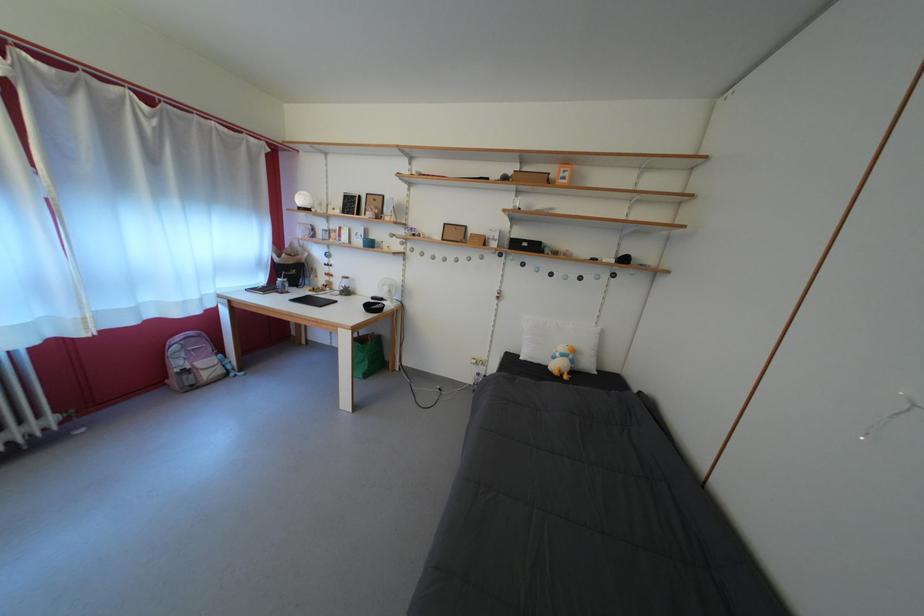
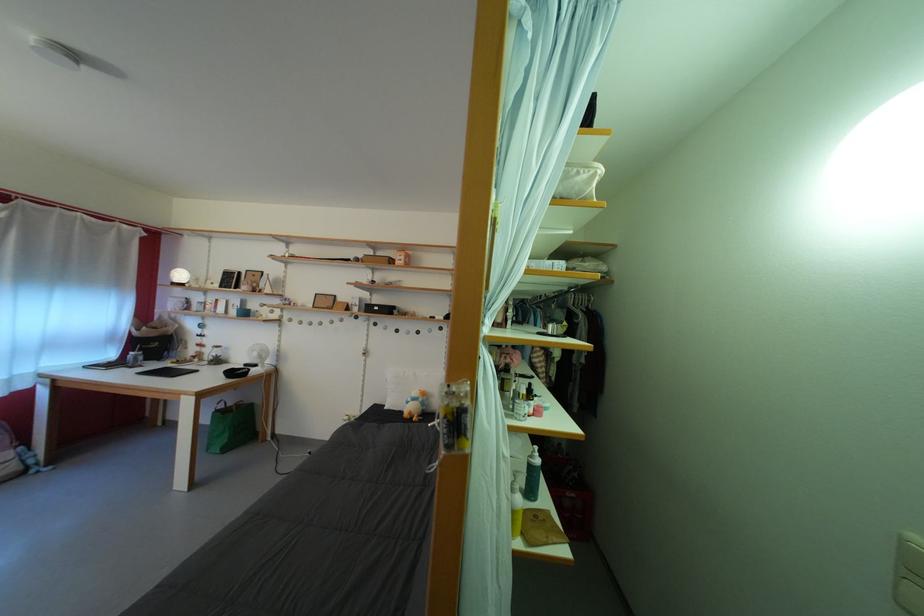
The point at (533, 251) is marked in the first image. Where is the corresponding point in the second image?

(384, 314)